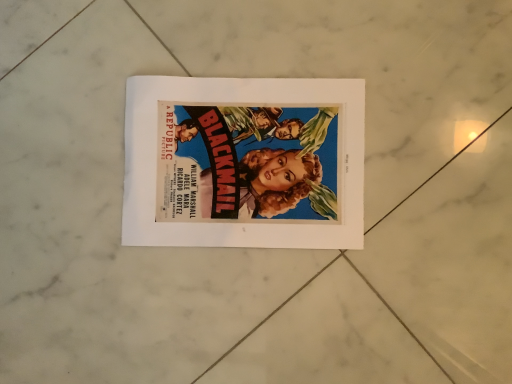
Locate an element on the screen. free space behind matte paper poster at center is located at coordinates (176, 41).